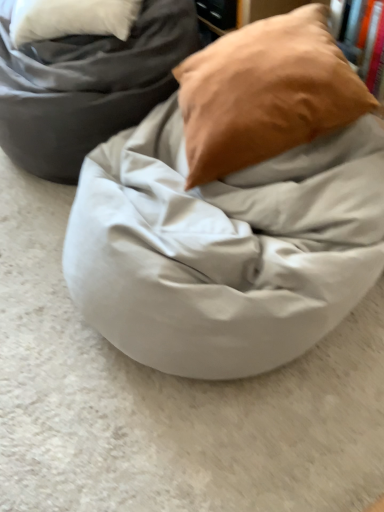
Question: Would you say matte gray bean bag at center is a long distance from matte brown pillow at upper right?

Choices:
 (A) yes
 (B) no

Answer: (B)

Question: From a real-world perspective, is matte gray bean bag at center below matte brown pillow at upper right?

Choices:
 (A) yes
 (B) no

Answer: (A)

Question: Can you confirm if matte gray bean bag at center is positioned to the right of matte brown pillow at upper right?

Choices:
 (A) no
 (B) yes

Answer: (A)

Question: Considering the relative positions of matte gray bean bag at center and matte brown pillow at upper right in the image provided, is matte gray bean bag at center in front of matte brown pillow at upper right?

Choices:
 (A) yes
 (B) no

Answer: (B)

Question: From the image's perspective, is matte gray bean bag at center located beneath matte brown pillow at upper right?

Choices:
 (A) no
 (B) yes

Answer: (A)

Question: Considering the positions of point [99, 79] and point [206, 106], is point [99, 79] closer or farther from the camera than point [206, 106]?

Choices:
 (A) farther
 (B) closer

Answer: (A)

Question: Do you think matte gray bean bag at center is within matte brown pillow at upper right, or outside of it?

Choices:
 (A) inside
 (B) outside

Answer: (B)

Question: Would you say matte gray bean bag at center is to the left or to the right of matte brown pillow at upper right in the picture?

Choices:
 (A) left
 (B) right

Answer: (A)

Question: Is matte gray bean bag at center taller or shorter than matte brown pillow at upper right?

Choices:
 (A) tall
 (B) short

Answer: (A)

Question: Considering the positions of matte white bean bag at center and matte brown pillow at upper right in the image, is matte white bean bag at center taller or shorter than matte brown pillow at upper right?

Choices:
 (A) tall
 (B) short

Answer: (B)

Question: Looking at their shapes, would you say matte white bean bag at center is wider or thinner than matte brown pillow at upper right?

Choices:
 (A) wide
 (B) thin

Answer: (A)

Question: Would you say matte white bean bag at center is to the left or to the right of matte brown pillow at upper right in the picture?

Choices:
 (A) left
 (B) right

Answer: (A)

Question: Considering the positions of matte white bean bag at center and matte brown pillow at upper right in the image, is matte white bean bag at center bigger or smaller than matte brown pillow at upper right?

Choices:
 (A) big
 (B) small

Answer: (A)

Question: Is matte brown pillow at upper right taller or shorter than matte gray bean bag at center?

Choices:
 (A) short
 (B) tall

Answer: (A)

Question: Considering their positions, is matte brown pillow at upper right located in front of or behind matte gray bean bag at center?

Choices:
 (A) front
 (B) behind

Answer: (A)